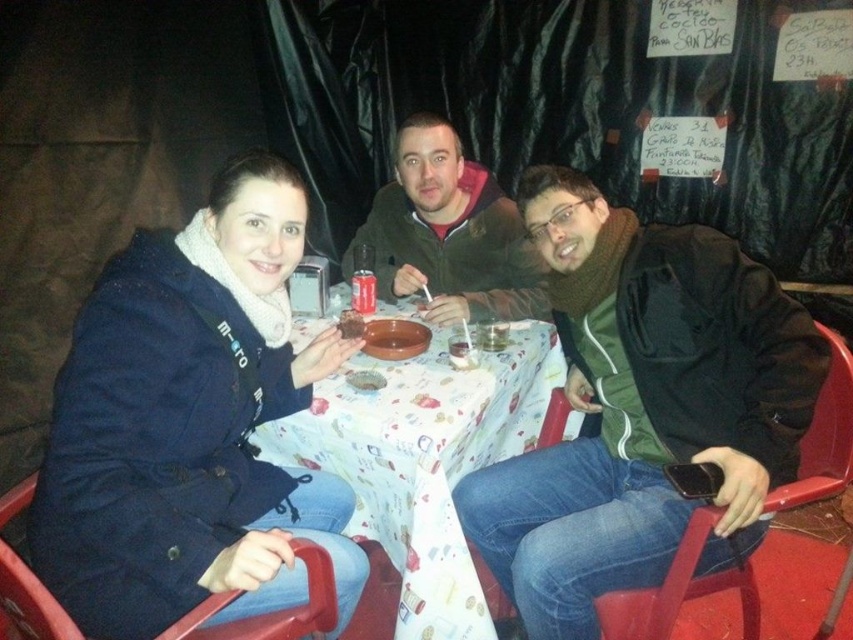
Question: Among these objects, which one is nearest to the camera?

Choices:
 (A) translucent plastic cup at center
 (B) white paper tablecloth at center
 (C) navy blue coat at center
 (D) matte brown bowl at center

Answer: (C)

Question: Does navy blue coat at center come in front of matte brown jacket at center?

Choices:
 (A) no
 (B) yes

Answer: (B)

Question: Among these objects, which one is farthest from the camera?

Choices:
 (A) matte brown bowl at center
 (B) matte brown jacket at center

Answer: (B)

Question: Is navy blue coat at center wider than white paper tablecloth at center?

Choices:
 (A) yes
 (B) no

Answer: (B)

Question: Estimate the real-world distances between objects in this image. Which object is farther from the translucent plastic cup at center?

Choices:
 (A) matte brown jacket at center
 (B) white paper tablecloth at center
 (C) navy blue coat at center
 (D) matte brown bowl at center

Answer: (C)

Question: Can you confirm if green matte jacket at center is wider than translucent plastic cup at center?

Choices:
 (A) yes
 (B) no

Answer: (A)